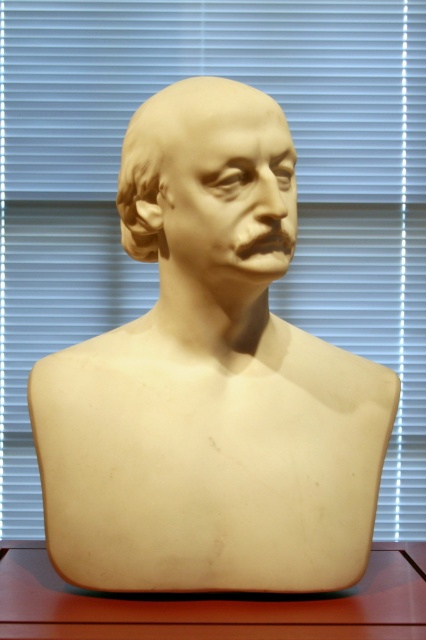
Consider the image. Can you confirm if matte beige bust at center is bigger than matte wood table at center?

Correct, matte beige bust at center is larger in size than matte wood table at center.

Is point (158, 236) farther from viewer compared to point (43, 586)?

Yes, it is behind point (43, 586).

Between point (149, 147) and point (57, 605), which one is positioned in front?

Positioned in front is point (57, 605).

At what (x,y) coordinates should I click in order to perform the action: click on matte beige bust at center. Please return your answer as a coordinate pair (x, y). Image resolution: width=426 pixels, height=640 pixels. Looking at the image, I should click on (210, 186).

Is white marble bust at center smaller than matte beige bust at center?

Incorrect, white marble bust at center is not smaller in size than matte beige bust at center.

Does white marble bust at center appear on the right side of matte beige bust at center?

Yes, white marble bust at center is to the right of matte beige bust at center.

Describe the element at coordinates (210, 381) in the screenshot. I see `white marble bust at center` at that location.

You are a GUI agent. You are given a task and a screenshot of the screen. Output one action in this format:
    pyautogui.click(x=<x>, y=<y>)
    Task: Click on the white marble bust at center
    The height and width of the screenshot is (640, 426).
    Given the screenshot: What is the action you would take?
    pyautogui.click(x=210, y=381)

Is white marble bust at center thinner than matte wood table at center?

Yes.

Is white marble bust at center wider than matte wood table at center?

No, white marble bust at center is not wider than matte wood table at center.

Identify the location of white marble bust at center. The height and width of the screenshot is (640, 426). pos(210,381).

This screenshot has width=426, height=640. I want to click on white marble bust at center, so click(x=210, y=381).